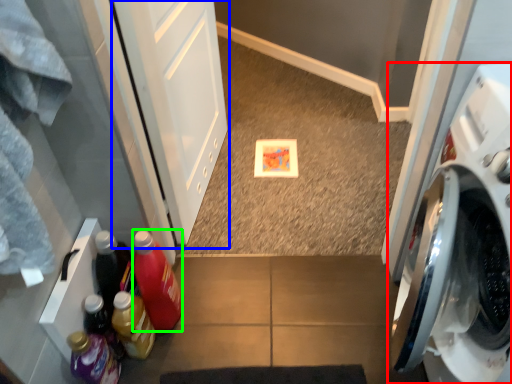
Question: Based on their relative distances, which object is farther from washing machine (highlighted by a red box)? Choose from screen door (highlighted by a blue box) and bottle (highlighted by a green box).

Choices:
 (A) screen door
 (B) bottle

Answer: (A)